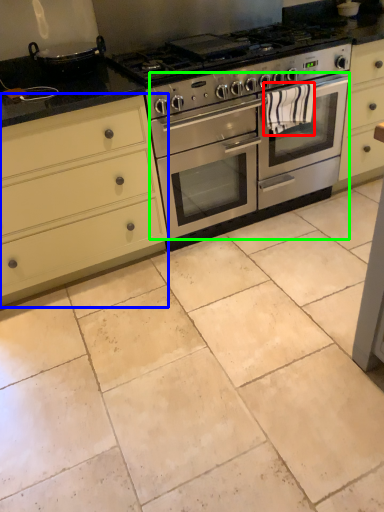
Question: Which is nearer to the material (highlighted by a red box)? cabinetry (highlighted by a blue box) or oven (highlighted by a green box).

Choices:
 (A) cabinetry
 (B) oven

Answer: (B)